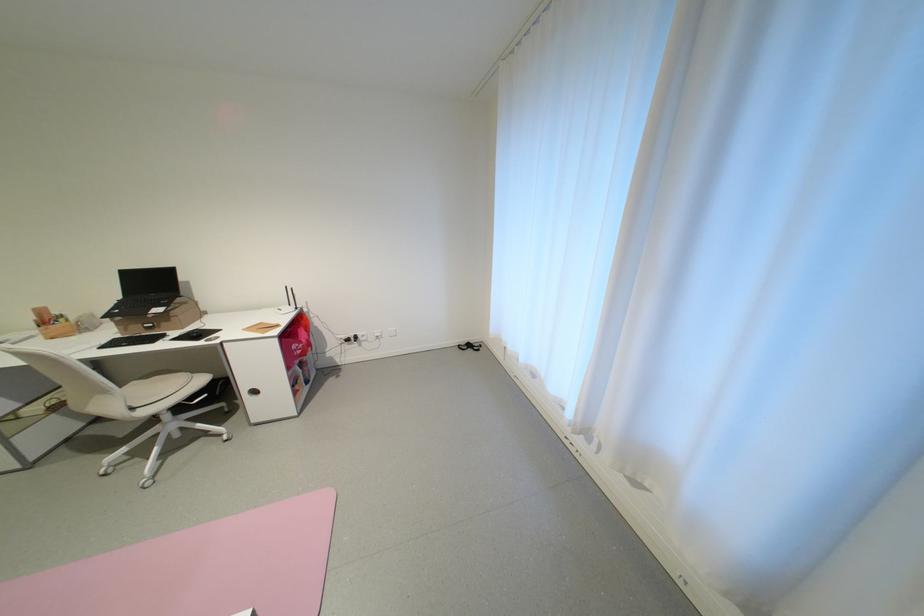
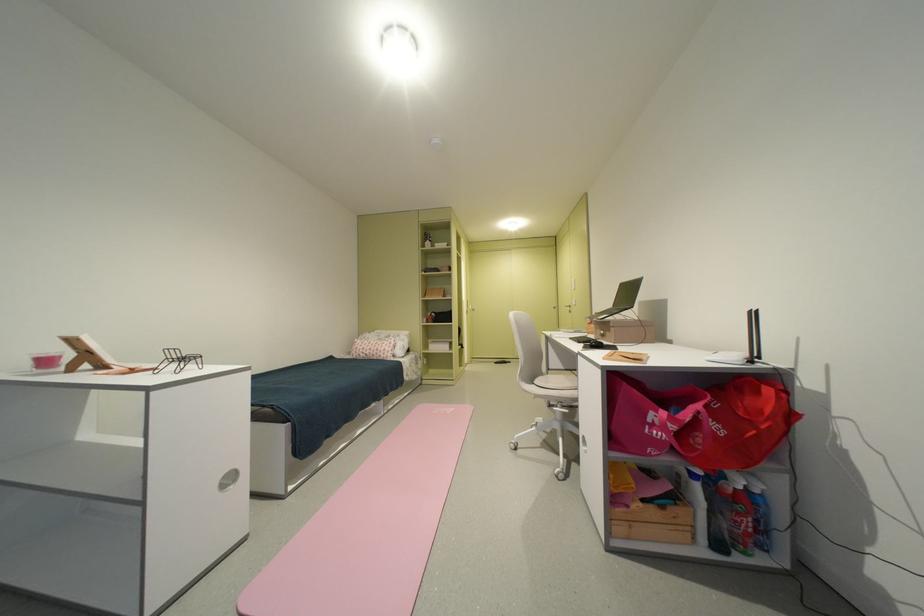
The point at (204, 334) is marked in the first image. Where is the corresponding point in the second image?

(602, 342)